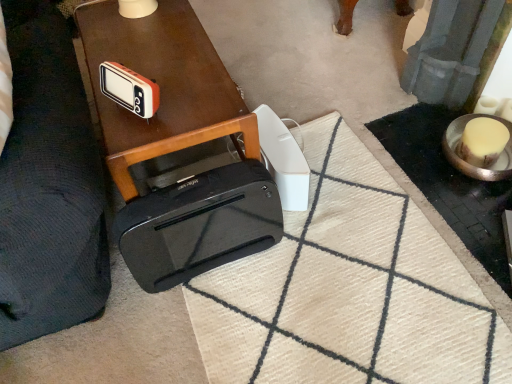
This screenshot has height=384, width=512. What are the coordinates of `free spot above shiny brown table at center (from a real-world perspective)` in the screenshot? It's located at (159, 53).